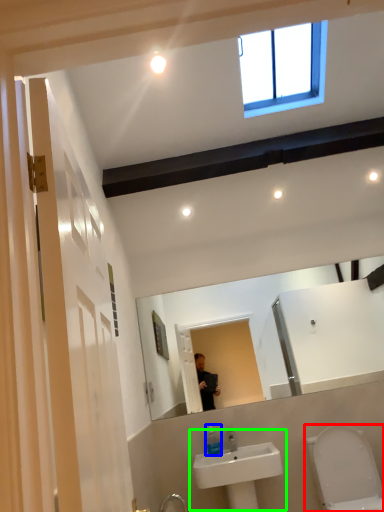
Question: Estimate the real-world distances between objects in this image. Which object is farther from toilet (highlighted by a red box), soap dispenser (highlighted by a blue box) or sink (highlighted by a green box)?

Choices:
 (A) soap dispenser
 (B) sink

Answer: (A)